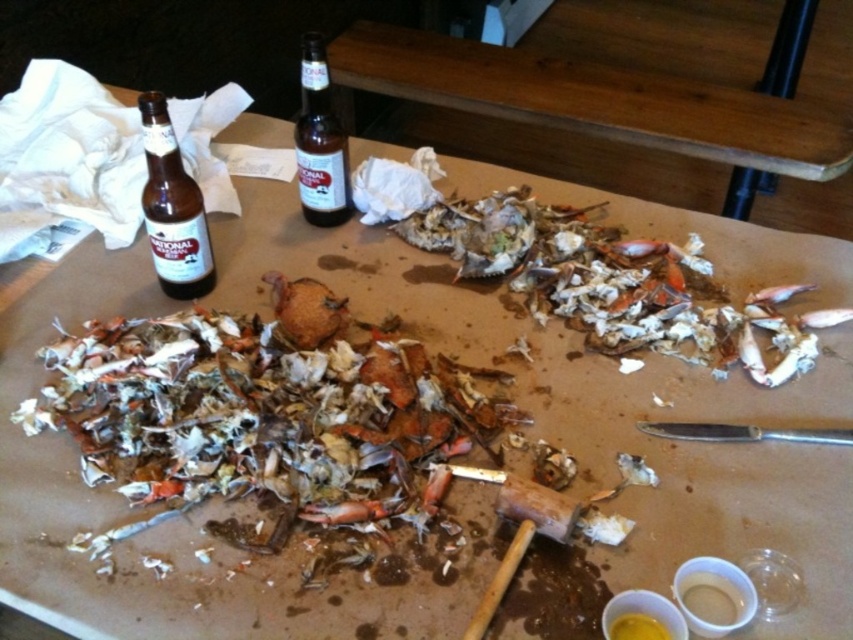
You have a small toy car that is 10 cm long. You want to place it on the table where there is space between the brown wood table at upper center and the brown glass bottle at left. Will the toy car fit in that space?

The brown wood table at upper center might be wider than brown glass bottle at left, so the space between them could accommodate the 10 cm toy car. However, since the exact width difference isn not specified, it is uncertain. Check the available space before placing the toy car.